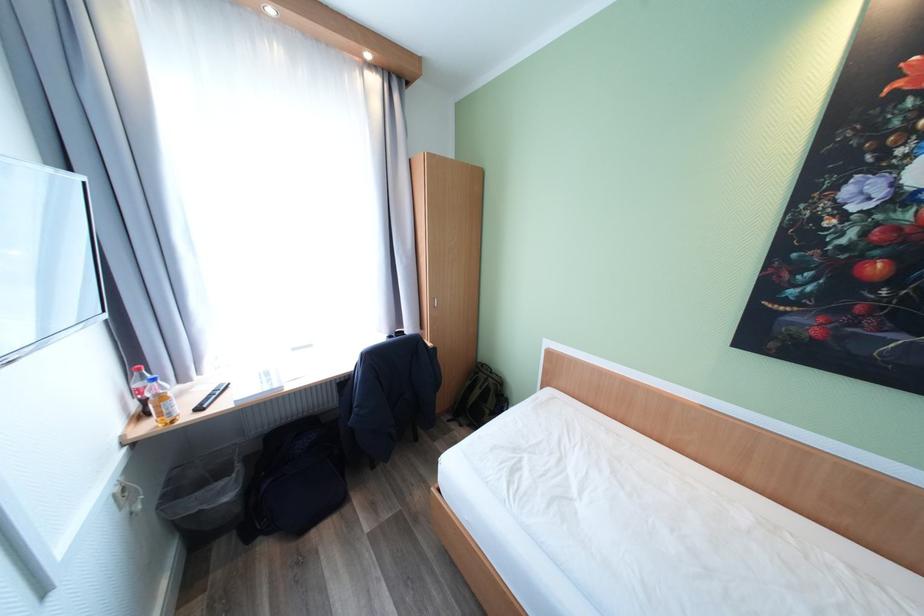
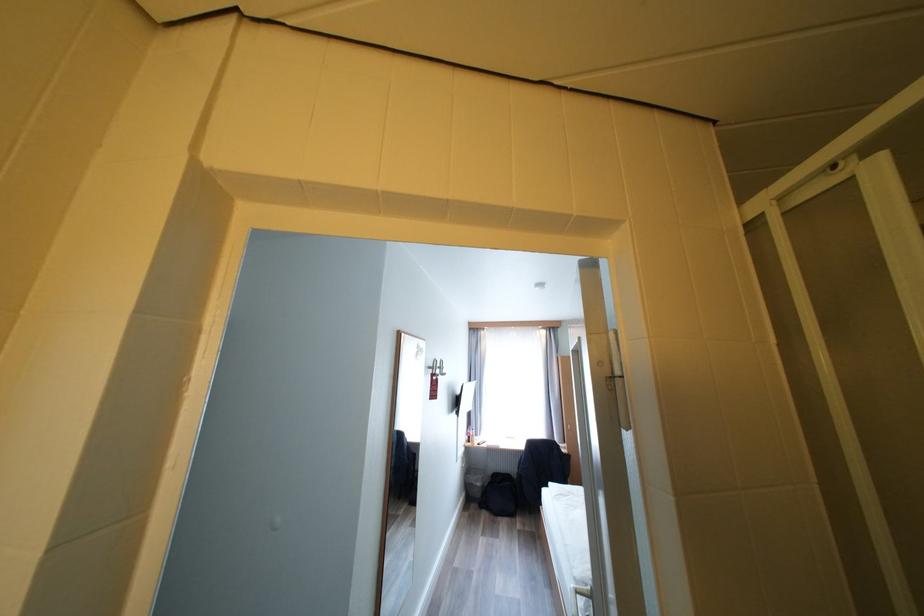
Find the pixel in the second image that matches (236,498) in the first image.

(485, 485)